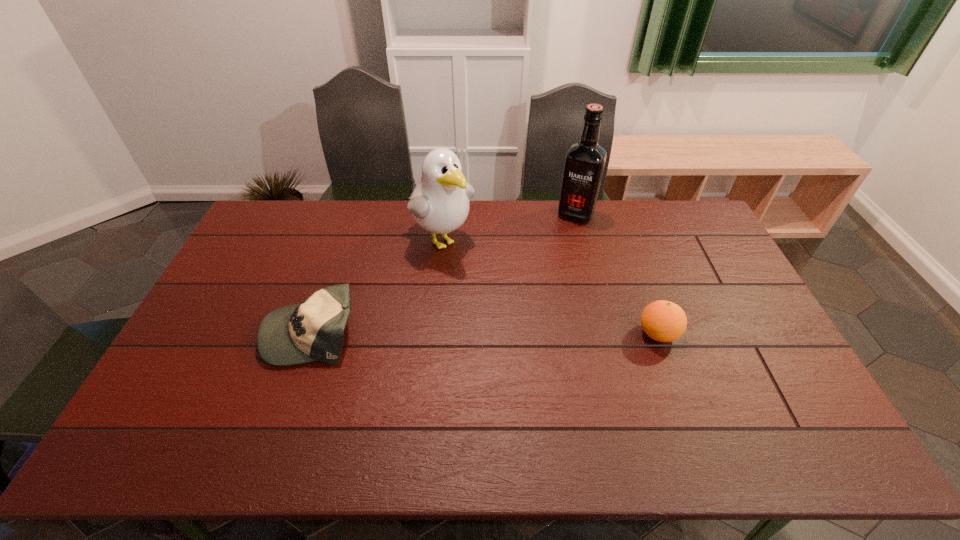
The height and width of the screenshot is (540, 960). I want to click on vacant spot on the desktop that is between the baseball cap and the orange and is positioned on the front-facing side of the liquor, so click(524, 333).

Locate an element on the screen. The image size is (960, 540). free space on the desktop that is between the leftmost object and the rightmost object and is positioned on the beak of the gull is located at coordinates pyautogui.click(x=537, y=333).